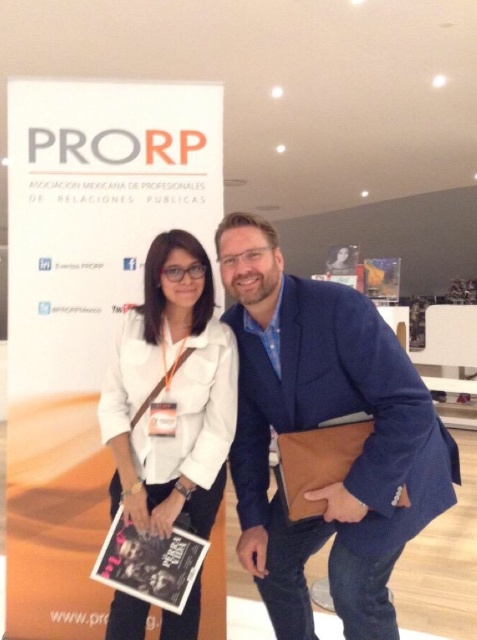
Question: Where is blue fabric jacket at center located in relation to white fabric shirt at center in the image?

Choices:
 (A) above
 (B) below

Answer: (A)

Question: Among these points, which one is farthest from the camera?

Choices:
 (A) (382, 444)
 (B) (117, 445)

Answer: (B)

Question: Is blue fabric jacket at center further to camera compared to white fabric shirt at center?

Choices:
 (A) yes
 (B) no

Answer: (B)

Question: Which object appears farthest from the camera in this image?

Choices:
 (A) white fabric shirt at center
 (B) blue fabric jacket at center

Answer: (A)

Question: Does blue fabric jacket at center have a lesser width compared to white fabric shirt at center?

Choices:
 (A) no
 (B) yes

Answer: (A)